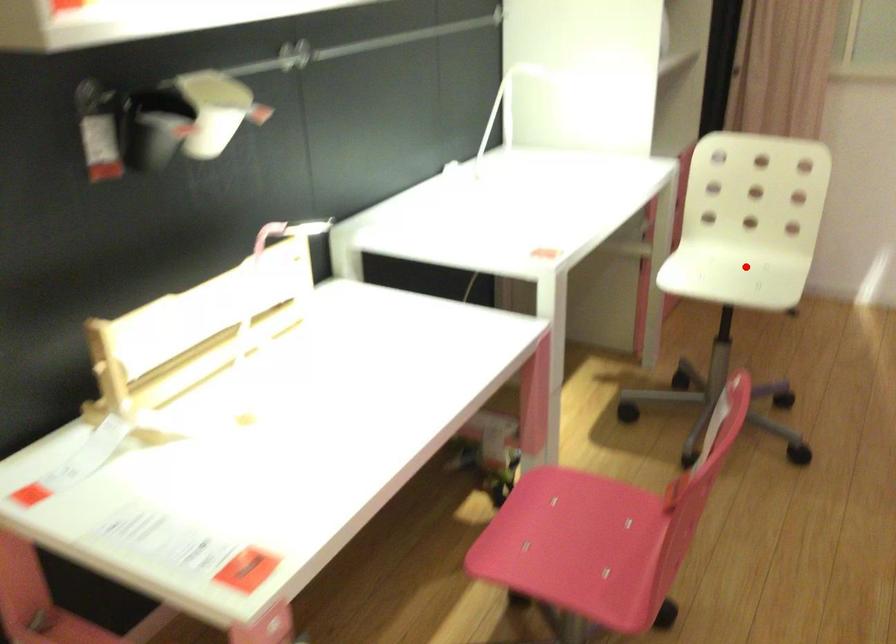
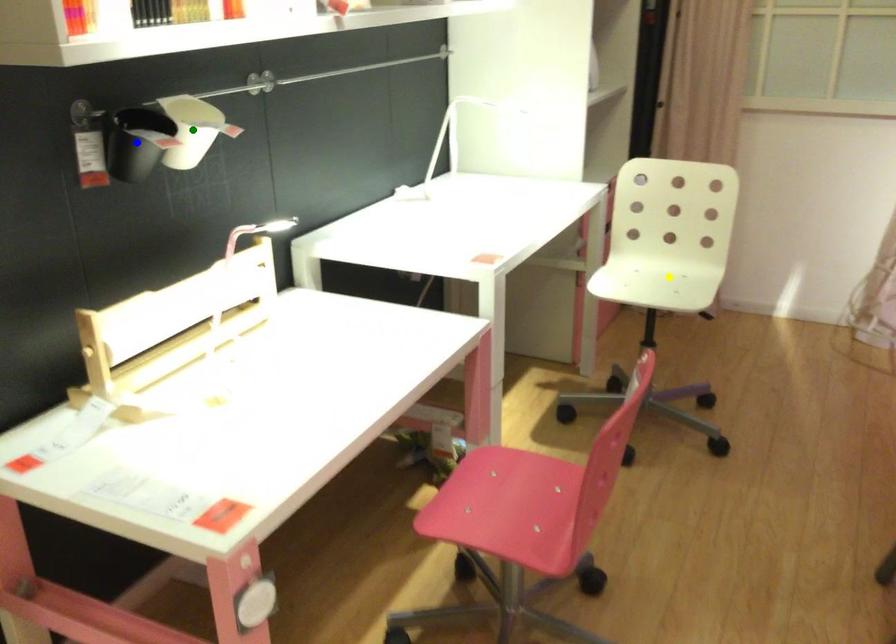
Question: I am providing you with two images of the same scene from different viewpoints. A red point is marked on the first image. You are given multiple points on the second image. In image 2, which mark is for the same physical point as the one in image 1?

Choices:
 (A) green point
 (B) yellow point
 (C) blue point

Answer: (B)